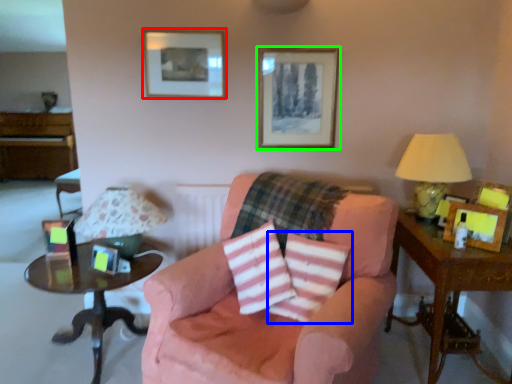
Question: Estimate the real-world distances between objects in this image. Which object is farther from picture frame (highlighted by a red box), throw pillow (highlighted by a blue box) or picture frame (highlighted by a green box)?

Choices:
 (A) throw pillow
 (B) picture frame

Answer: (A)